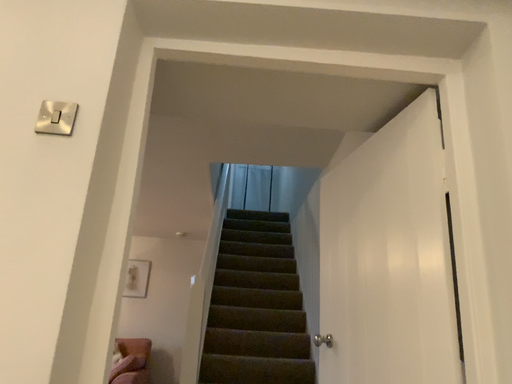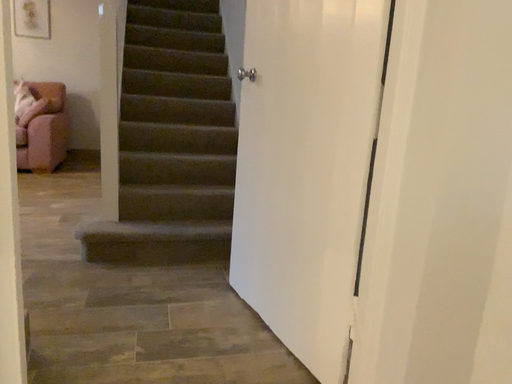
Question: Which way did the camera rotate in the video?

Choices:
 (A) rotated right
 (B) rotated left

Answer: (A)